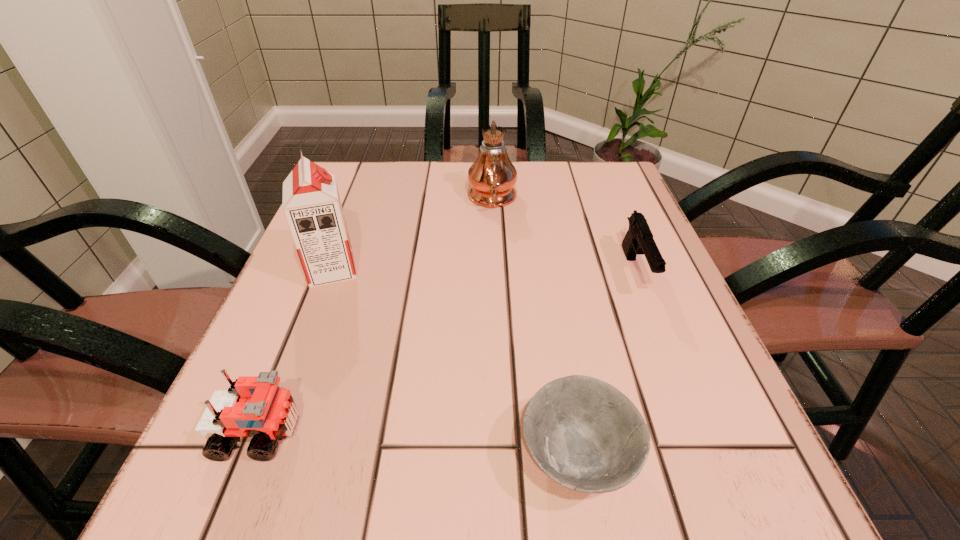
I want to click on vacant region at the far edge of the desktop, so click(415, 176).

You are a GUI agent. You are given a task and a screenshot of the screen. Output one action in this format:
    pyautogui.click(x=<x>, y=<y>)
    Task: Click on the vacant space at the left edge of the desktop
    This screenshot has height=540, width=960.
    Given the screenshot: What is the action you would take?
    pyautogui.click(x=338, y=329)

What are the coordinates of `free space at the right edge` in the screenshot? It's located at (702, 384).

Identify the location of vacant space at the far left corner of the desktop. The height and width of the screenshot is (540, 960). (357, 201).

In the image, there is a desktop. At what (x,y) coordinates should I click in order to perform the action: click on vacant space at the far right corner. Please return your answer as a coordinate pair (x, y). The height and width of the screenshot is (540, 960). Looking at the image, I should click on (609, 166).

Identify the location of free point between the oil lamp and the Lego. (376, 315).

Image resolution: width=960 pixels, height=540 pixels. What are the coordinates of `free area in between the bowl and the pistol` in the screenshot? It's located at (607, 364).

I want to click on vacant space that is in between the farthest object and the shortest object, so click(535, 328).

This screenshot has height=540, width=960. Find the location of `unoccupied position between the Lego and the pistol`. unoccupied position between the Lego and the pistol is located at coordinates (447, 352).

Image resolution: width=960 pixels, height=540 pixels. I want to click on vacant area between the farthest object and the Lego, so click(x=376, y=315).